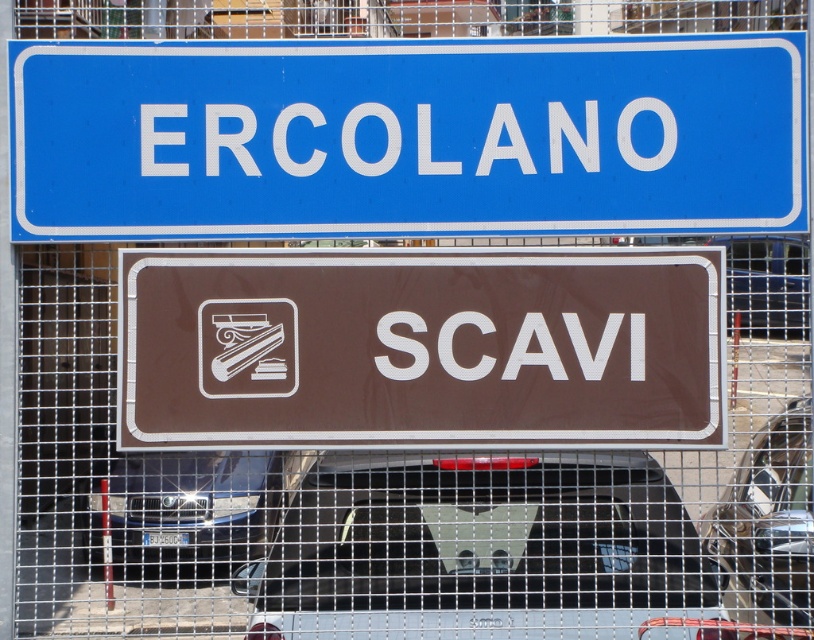
Question: Does blue plastic signboard at upper center have a lesser width compared to black metallic car at center?

Choices:
 (A) yes
 (B) no

Answer: (B)

Question: Can you confirm if brown plastic sign at center is positioned above metallic silver car at center?

Choices:
 (A) no
 (B) yes

Answer: (B)

Question: Which point is farther to the camera?

Choices:
 (A) (333, 579)
 (B) (795, 401)

Answer: (B)

Question: Estimate the real-world distances between objects in this image. Which object is farther from the blue plastic signboard at upper center?

Choices:
 (A) black metallic car at center
 (B) metallic silver car at center
 (C) brown plastic sign at center
 (D) black matte car at lower center

Answer: (A)

Question: Which point is farther to the camera?

Choices:
 (A) black metallic car at center
 (B) brown plastic sign at center

Answer: (A)

Question: Does black matte car at lower center appear on the right side of black metallic car at center?

Choices:
 (A) no
 (B) yes

Answer: (B)